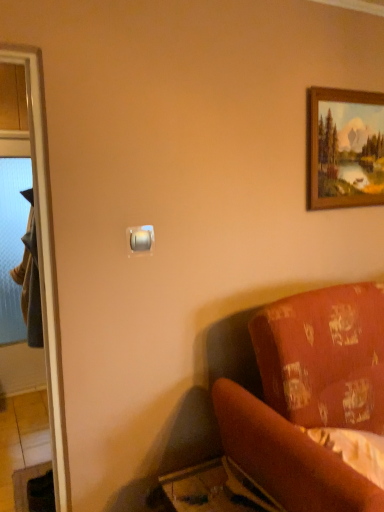
Question: Is velvet-like red couch at lower right not close to satin gold switch at upper center?

Choices:
 (A) yes
 (B) no

Answer: (B)

Question: Can you confirm if velvet-like red couch at lower right is taller than satin gold switch at upper center?

Choices:
 (A) no
 (B) yes

Answer: (B)

Question: Does velvet-like red couch at lower right have a smaller size compared to satin gold switch at upper center?

Choices:
 (A) no
 (B) yes

Answer: (A)

Question: Is the position of velvet-like red couch at lower right less distant than that of satin gold switch at upper center?

Choices:
 (A) yes
 (B) no

Answer: (A)

Question: From a real-world perspective, is velvet-like red couch at lower right under satin gold switch at upper center?

Choices:
 (A) no
 (B) yes

Answer: (B)

Question: From the image's perspective, is satin gold switch at upper center located above or below dark gray fabric robe at left?

Choices:
 (A) below
 (B) above

Answer: (B)

Question: Is point (127, 240) positioned closer to the camera than point (26, 270)?

Choices:
 (A) farther
 (B) closer

Answer: (B)

Question: Considering the positions of satin gold switch at upper center and dark gray fabric robe at left in the image, is satin gold switch at upper center taller or shorter than dark gray fabric robe at left?

Choices:
 (A) short
 (B) tall

Answer: (A)

Question: Considering their positions, is satin gold switch at upper center located in front of or behind dark gray fabric robe at left?

Choices:
 (A) front
 (B) behind

Answer: (B)

Question: Do you think dark gray fabric robe at left is within velvet-like red couch at lower right, or outside of it?

Choices:
 (A) inside
 (B) outside

Answer: (B)

Question: From the image's perspective, is dark gray fabric robe at left positioned above or below velvet-like red couch at lower right?

Choices:
 (A) below
 (B) above

Answer: (B)

Question: Is dark gray fabric robe at left to the left or to the right of velvet-like red couch at lower right in the image?

Choices:
 (A) left
 (B) right

Answer: (A)

Question: Relative to velvet-like red couch at lower right, is dark gray fabric robe at left in front or behind?

Choices:
 (A) front
 (B) behind

Answer: (B)

Question: Would you say dark gray fabric robe at left is to the left or to the right of wooden picture frame at upper right in the picture?

Choices:
 (A) left
 (B) right

Answer: (A)

Question: Looking at their shapes, would you say dark gray fabric robe at left is wider or thinner than wooden picture frame at upper right?

Choices:
 (A) wide
 (B) thin

Answer: (A)